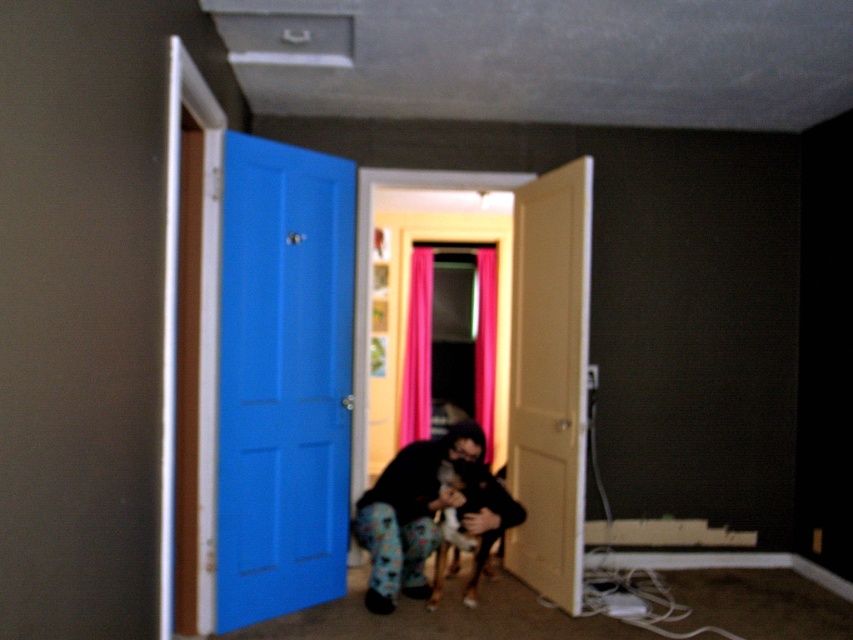
Is point (276, 524) positioned behind point (419, 499)?

No, it is not.

Who is more forward, (350, 264) or (364, 548)?

Point (364, 548) is more forward.

Between point (323, 314) and point (502, 522), which one is positioned in front?

Point (323, 314) is more forward.

You are a GUI agent. You are given a task and a screenshot of the screen. Output one action in this format:
    pyautogui.click(x=<x>, y=<y>)
    Task: Click on the blue painted door at left
    
    Given the screenshot: What is the action you would take?
    pyautogui.click(x=283, y=380)

Does blue painted door at left come behind matte yellow door at center?

No.

Does point (218, 493) come in front of point (537, 480)?

Yes.

Is point (340, 580) farther from camera compared to point (563, 508)?

Yes, it is.

Locate an element on the screen. This screenshot has height=640, width=853. blue painted door at left is located at coordinates (283, 380).

Consider the image. Is the position of matte yellow door at center more distant than that of fluffy fur dog at center?

That is False.

Measure the distance between matte yellow door at center and camera.

matte yellow door at center and camera are 12.15 feet apart from each other.

Where is `matte yellow door at center`? Image resolution: width=853 pixels, height=640 pixels. matte yellow door at center is located at coordinates (549, 380).